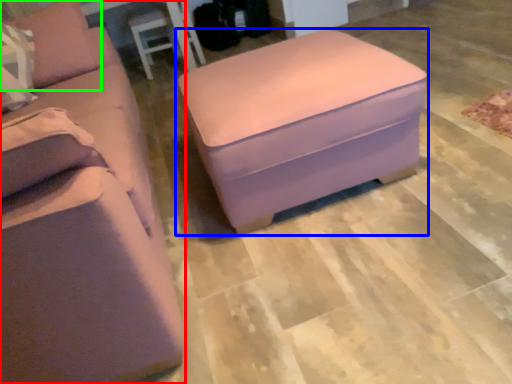
Question: Which is farther away from studio couch (highlighted by a red box)? table (highlighted by a blue box) or pillow (highlighted by a green box)?

Choices:
 (A) table
 (B) pillow

Answer: (A)